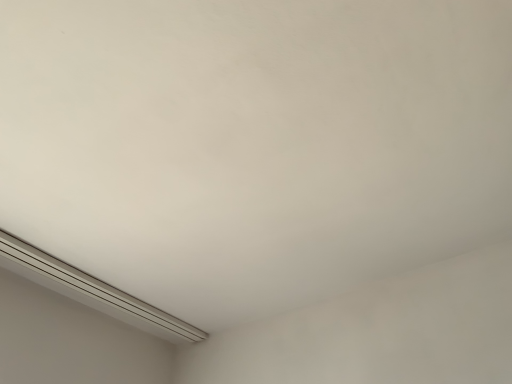
Find the location of a particular element. The height and width of the screenshot is (384, 512). metallic silver window at bottom left is located at coordinates (91, 291).

The height and width of the screenshot is (384, 512). What do you see at coordinates (91, 291) in the screenshot?
I see `metallic silver window at bottom left` at bounding box center [91, 291].

Find the location of a particular element. This screenshot has width=512, height=384. metallic silver window at bottom left is located at coordinates (91, 291).